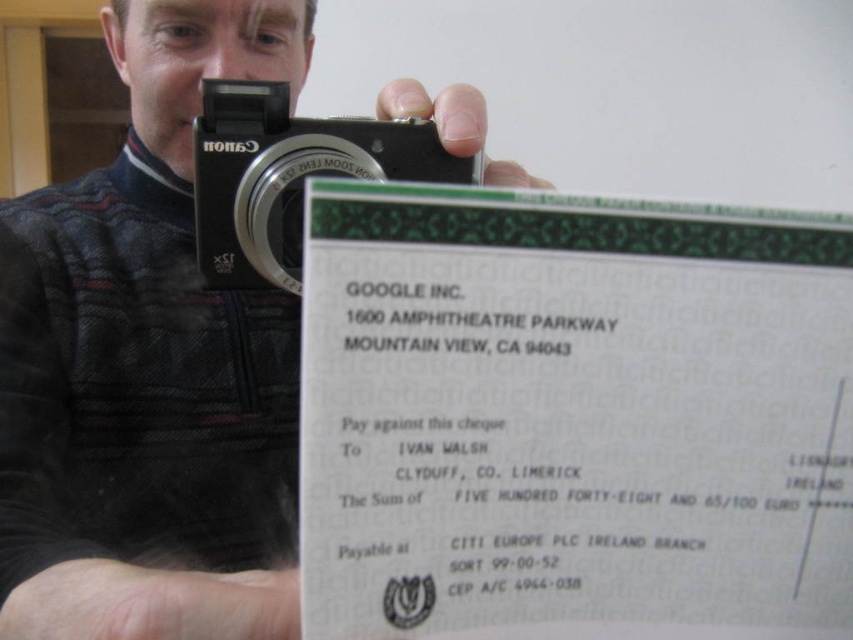
Can you confirm if black plastic camera at upper center is positioned to the left of black matte camera at upper center?

Correct, you'll find black plastic camera at upper center to the left of black matte camera at upper center.

Who is higher up, black plastic camera at upper center or black matte camera at upper center?

black matte camera at upper center is higher up.

Does point (325, 163) come in front of point (469, 118)?

No, it is not.

You are a GUI agent. You are given a task and a screenshot of the screen. Output one action in this format:
    pyautogui.click(x=<x>, y=<y>)
    Task: Click on the black plastic camera at upper center
    Image resolution: width=853 pixels, height=640 pixels.
    Given the screenshot: What is the action you would take?
    pyautogui.click(x=289, y=176)

Is white paper at center positioned at the back of black matte camera at upper center?

No.

Does white paper at center appear on the left side of black matte camera at upper center?

Indeed, white paper at center is positioned on the left side of black matte camera at upper center.

You are a GUI agent. You are given a task and a screenshot of the screen. Output one action in this format:
    pyautogui.click(x=<x>, y=<y>)
    Task: Click on the white paper at center
    Image resolution: width=853 pixels, height=640 pixels.
    Given the screenshot: What is the action you would take?
    pyautogui.click(x=146, y=368)

Which is above, white paper at center or black plastic camera at upper center?

black plastic camera at upper center is higher up.

Where is `white paper at center`? white paper at center is located at coordinates (146, 368).